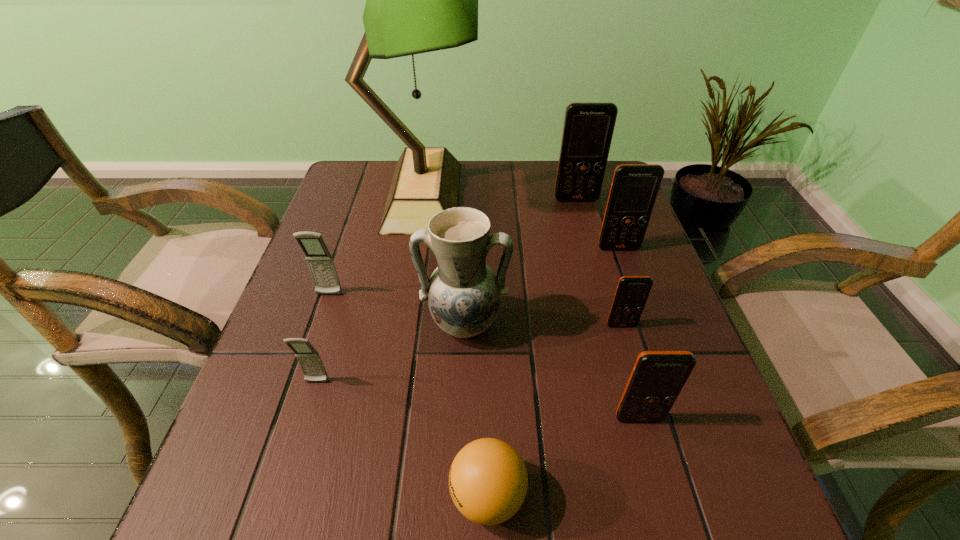
You are a GUI agent. You are given a task and a screenshot of the screen. Output one action in this format:
    pyautogui.click(x=<x>, y=<y>)
    Task: Click on the eighth farthest object
    The height and width of the screenshot is (540, 960).
    Given the screenshot: What is the action you would take?
    pyautogui.click(x=657, y=378)

Locate an element on the screen. This screenshot has width=960, height=540. the third farthest orange cellular telephone is located at coordinates (632, 292).

Where is `the smallest orange cellular telephone`? the smallest orange cellular telephone is located at coordinates (632, 292).

Identify the location of the smaller gray cellular telephone. The image size is (960, 540). (309, 359).

Where is `the third nearest object`? The image size is (960, 540). the third nearest object is located at coordinates (309, 359).

You are a GUI agent. You are given a task and a screenshot of the screen. Output one action in this format:
    pyautogui.click(x=<x>, y=<y>)
    Task: Click on the ping-pong ball
    The image size is (960, 540).
    Given the screenshot: What is the action you would take?
    pyautogui.click(x=488, y=481)

Where is `the shortest object`? the shortest object is located at coordinates (488, 481).

At what (x,y) coordinates should I click in order to perform the action: click on vacant area situated on the metallic stand of the green table lamp. Please return your answer as a coordinate pair (x, y). Looking at the image, I should click on (543, 195).

Find the location of a particular element. This screenshot has width=960, height=540. free location located on the screen of the tallest cellular telephone is located at coordinates (598, 280).

I want to click on vacant position located 0.210m on either side of the pottery, so click(x=460, y=461).